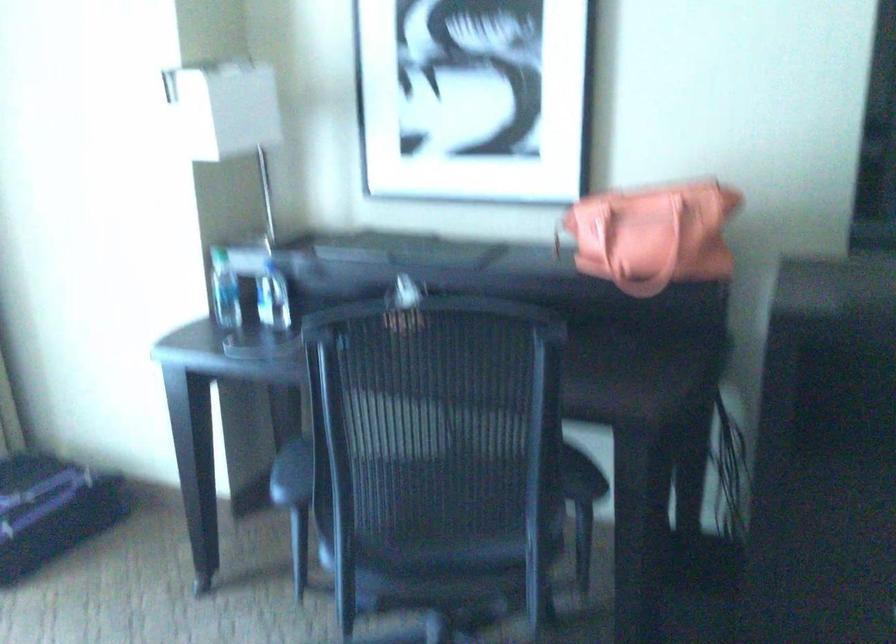
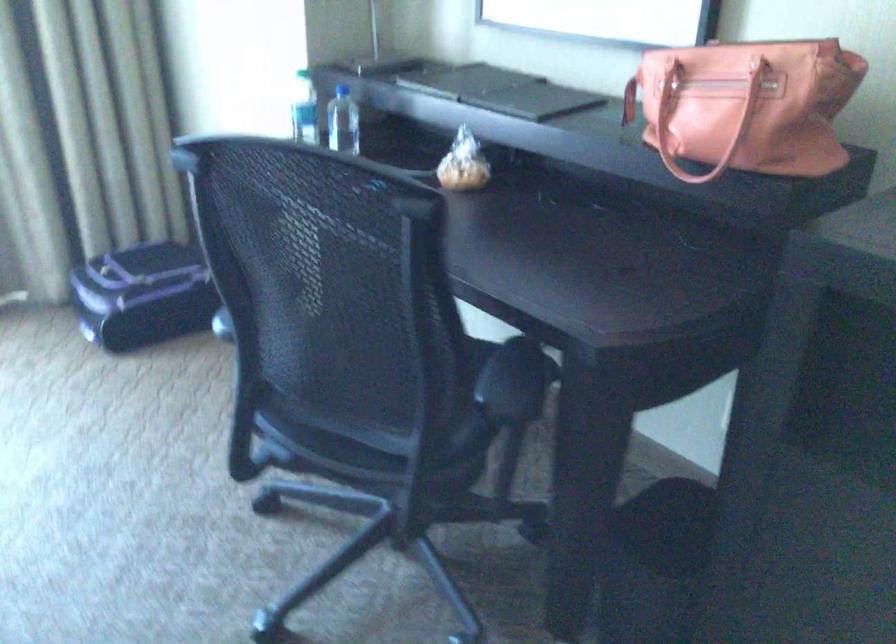
The point at (220, 287) is marked in the first image. Where is the corresponding point in the second image?

(304, 109)